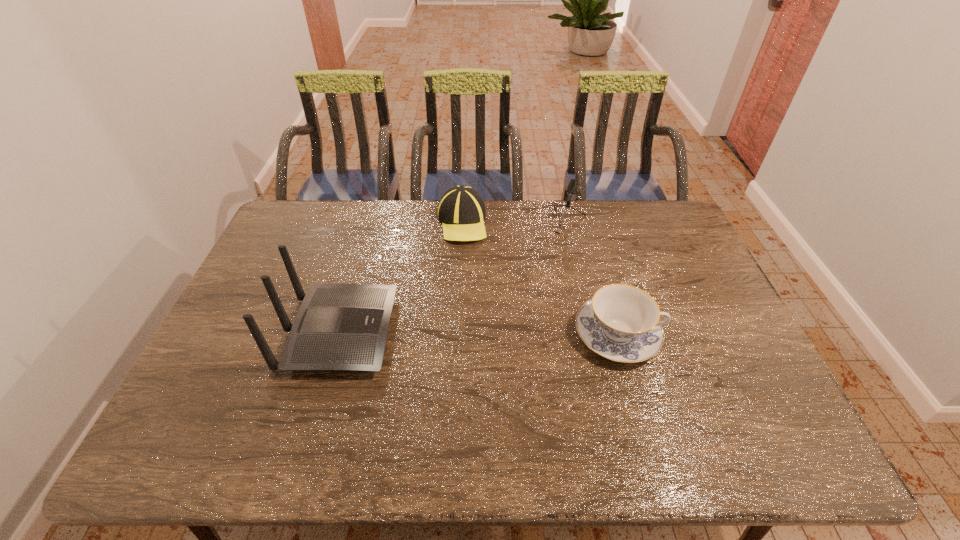
You are a GUI agent. You are given a task and a screenshot of the screen. Output one action in this format:
    pyautogui.click(x=<x>, y=<y>)
    Task: Click on the free space on the desktop that is between the tallest object and the chinaware and is positioned on the stand of the microphone
    The height and width of the screenshot is (540, 960).
    Given the screenshot: What is the action you would take?
    pyautogui.click(x=491, y=334)

I want to click on free spot on the desktop that is between the tallest object and the chinaware and is positioned with the brim of the third object from right to left facing forward, so click(438, 334).